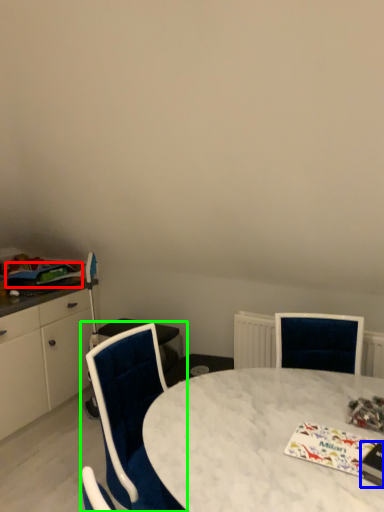
Question: Which object is positioned closest to magazine (highlighted by a red box)? Select from magazine (highlighted by a blue box) and chair (highlighted by a green box).

Choices:
 (A) magazine
 (B) chair

Answer: (B)